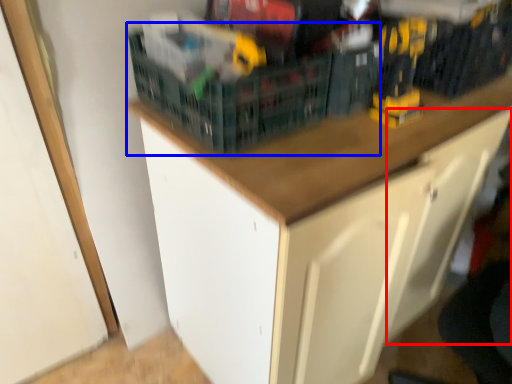
Question: Which object appears farthest to the camera in this image, drawer (highlighted by a red box) or basket (highlighted by a blue box)?

Choices:
 (A) drawer
 (B) basket

Answer: (B)